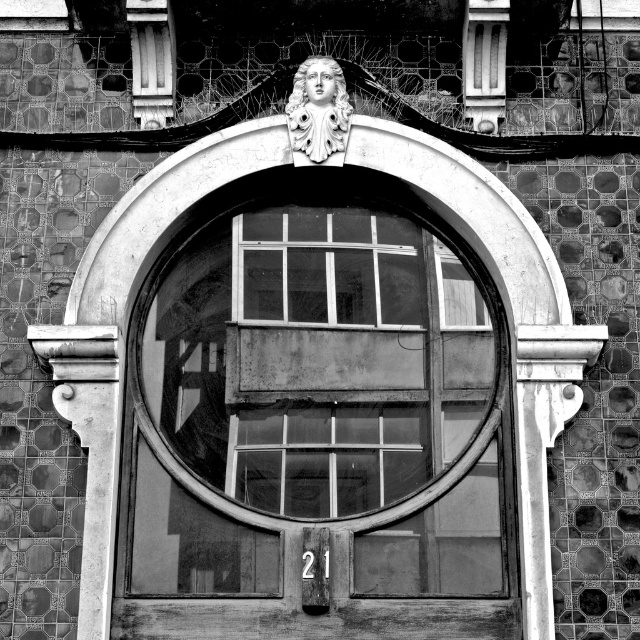
Is transparent glass window at center wider than matte stone face at upper center?

Correct, the width of transparent glass window at center exceeds that of matte stone face at upper center.

Between transparent glass window at center and matte stone face at upper center, which one is positioned lower?

transparent glass window at center is below.

Between point (371, 595) and point (314, 67), which one is positioned behind?

The point (314, 67) is behind.

I want to click on transparent glass window at center, so click(x=314, y=397).